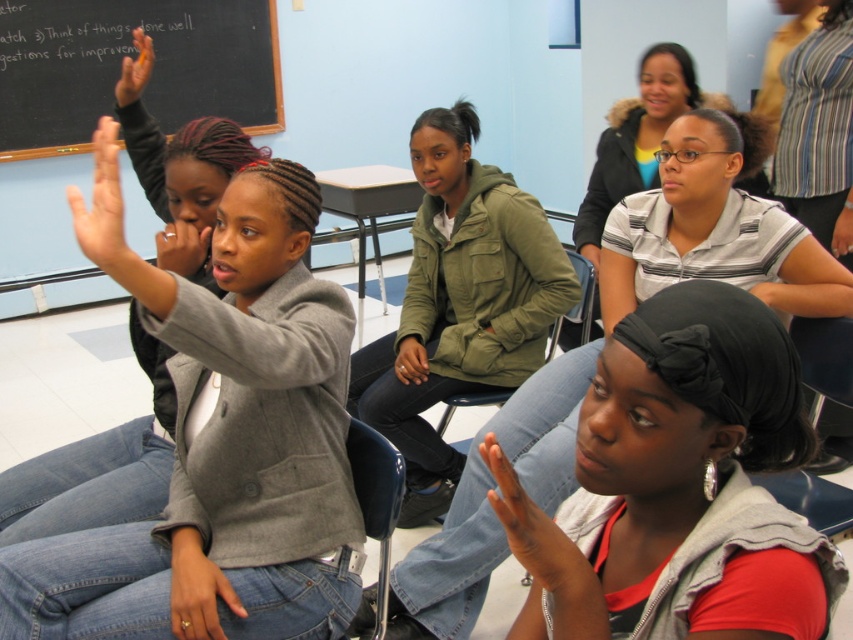
Question: In this image, where is black chalkboard at upper left located relative to smooth skin hand at lower center?

Choices:
 (A) left
 (B) right

Answer: (A)

Question: Which point is closer to the camera?

Choices:
 (A) (648, 145)
 (B) (409, 310)
 (C) (100, 195)

Answer: (C)

Question: Is striped polo shirt at upper right above blue plastic chair at lower center?

Choices:
 (A) yes
 (B) no

Answer: (A)

Question: Which object appears closest to the camera in this image?

Choices:
 (A) gray woolen blazer at upper left
 (B) blue plastic chair at lower center

Answer: (B)

Question: Which object is the farthest from the matte gray hand at upper left?

Choices:
 (A) blue plastic chair at lower center
 (B) gray woolen blazer at upper left
 (C) striped shirt at upper right
 (D) matte black hand at upper left

Answer: (C)

Question: Can you confirm if striped shirt at upper right is smaller than matte gray hand at upper left?

Choices:
 (A) yes
 (B) no

Answer: (B)